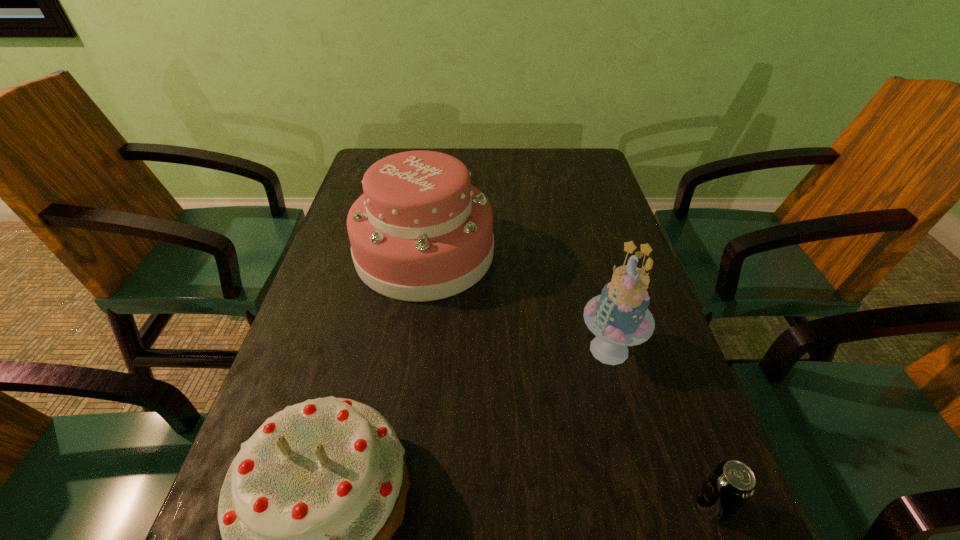
I want to click on vacant space that satisfies the following two spatial constraints: 1. with a ladder on the side of the second farthest object; 2. on the right side of the rightmost object, so click(x=651, y=506).

Where is `free location that satisfies the following two spatial constraints: 1. with a ladder on the side of the soda can; 2. on the right side of the rightmost cake`? free location that satisfies the following two spatial constraints: 1. with a ladder on the side of the soda can; 2. on the right side of the rightmost cake is located at coordinates (651, 506).